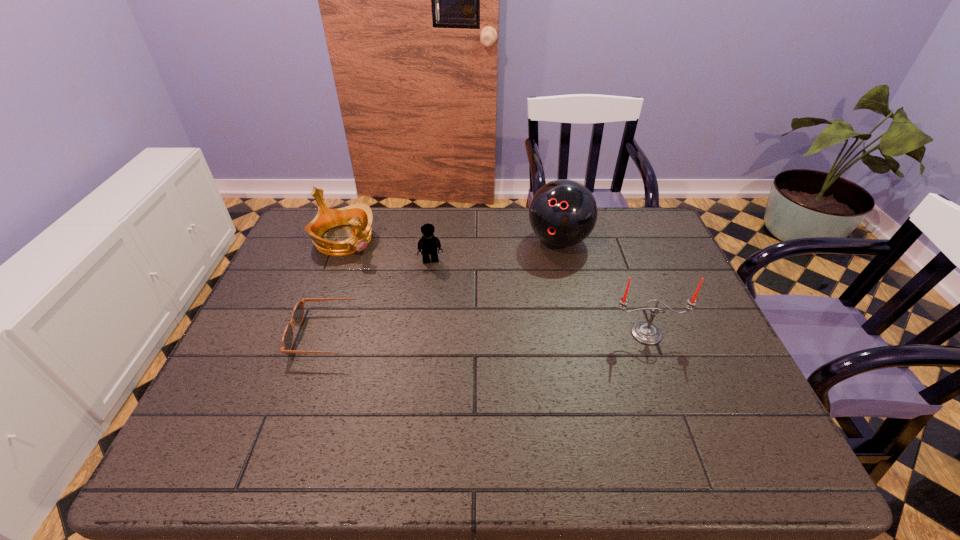
This screenshot has height=540, width=960. What are the coordinates of `free space located on the surface of the bowling ball near the finger holes` in the screenshot? It's located at (539, 275).

The image size is (960, 540). What are the coordinates of `free spot located on the front-facing side of the third object from left to right` in the screenshot? It's located at (449, 367).

Image resolution: width=960 pixels, height=540 pixels. Identify the location of free region located 0.190m on the front-facing side of the third object from left to right. (441, 314).

Image resolution: width=960 pixels, height=540 pixels. I want to click on free space located 0.250m on the front-facing side of the third object from left to right, so [x=444, y=331].

Locate an element on the screen. The image size is (960, 540). free space located at the front emblem of the tiara is located at coordinates (427, 305).

The width and height of the screenshot is (960, 540). In order to click on free space located at the front emblem of the tiara in this screenshot , I will do `click(450, 322)`.

I want to click on vacant space positioned 0.210m at the front emblem of the tiara, so click(404, 287).

Locate an element on the screen. The image size is (960, 540). bowling ball present at the far edge is located at coordinates (562, 213).

This screenshot has height=540, width=960. What are the coordinates of `tiara that is at the far edge` in the screenshot? It's located at (359, 216).

At what (x,y) coordinates should I click in order to perform the action: click on sunglasses situated at the left edge. Please return your answer as a coordinate pair (x, y). This screenshot has height=540, width=960. Looking at the image, I should click on (298, 312).